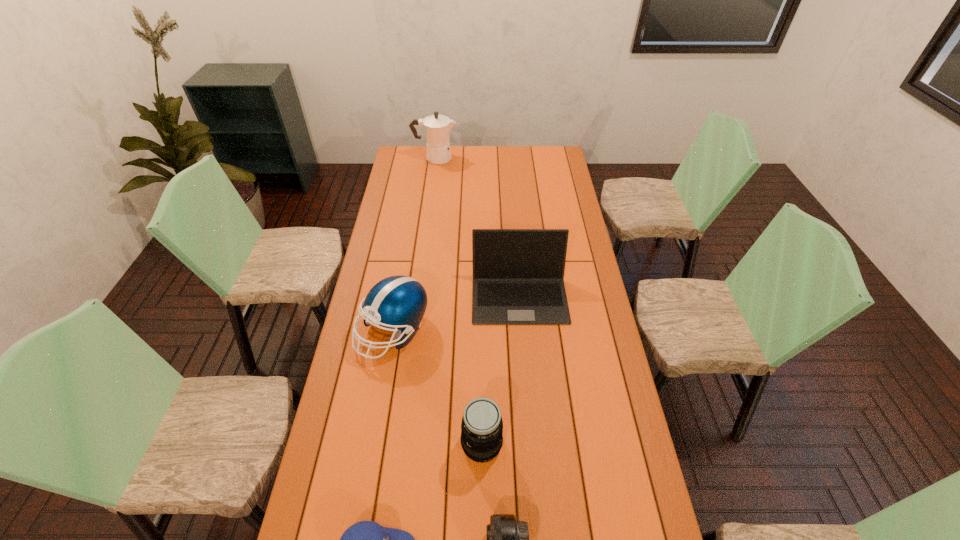
I want to click on object that is the fifth nearest to the laptop, so click(437, 128).

Where is `vacant space that satisfies the following two spatial constraints: 1. at the front of the taller telephoto lens with the faceguard; 2. on the right side of the football helmet`? This screenshot has width=960, height=540. vacant space that satisfies the following two spatial constraints: 1. at the front of the taller telephoto lens with the faceguard; 2. on the right side of the football helmet is located at coordinates (374, 443).

Where is `free spot that satisfies the following two spatial constraints: 1. at the front of the third nearest object with the faceguard; 2. on the left side of the football helmet`? This screenshot has width=960, height=540. free spot that satisfies the following two spatial constraints: 1. at the front of the third nearest object with the faceguard; 2. on the left side of the football helmet is located at coordinates (374, 443).